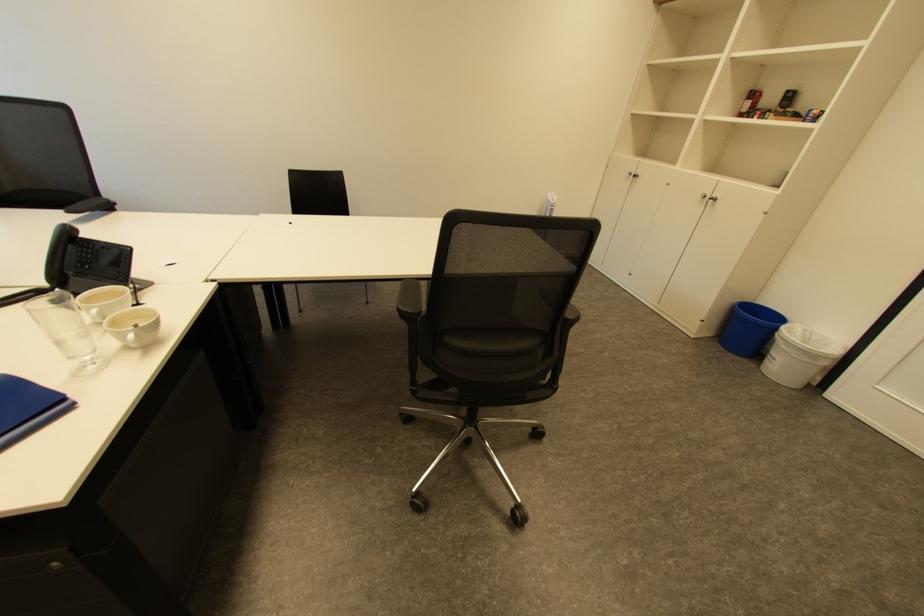
Where would you lift the clear drinking glass? Please return your answer as a coordinate pair (x, y).

(66, 331)